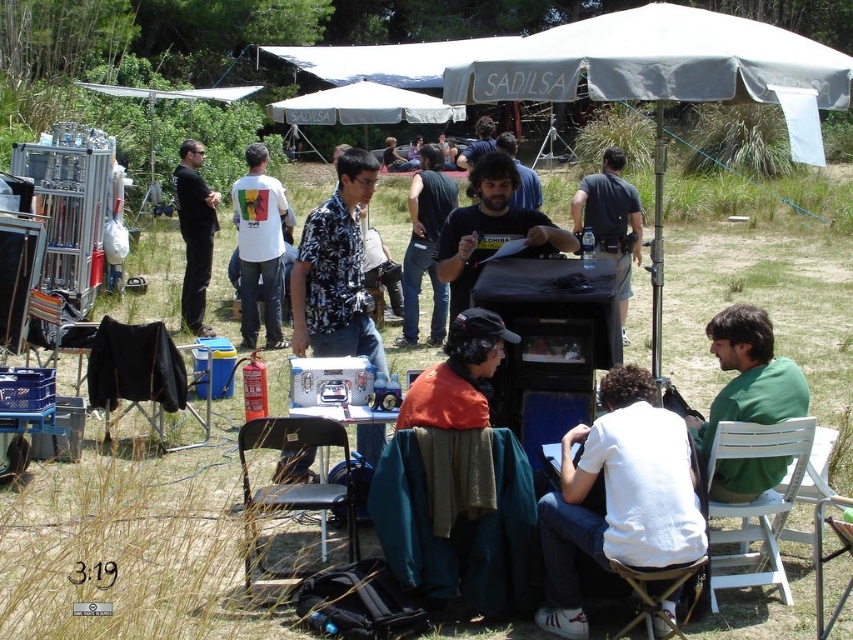
Is white cotton shirt at lower right wider than black fabric chair at lower left?

In fact, white cotton shirt at lower right might be narrower than black fabric chair at lower left.

Does point (650, 465) lie in front of point (96, 355)?

Yes, it is in front of point (96, 355).

The height and width of the screenshot is (640, 853). I want to click on white cotton shirt at lower right, so click(x=619, y=497).

The width and height of the screenshot is (853, 640). I want to click on white cotton shirt at lower right, so click(x=619, y=497).

Does black cotton shirt at center come behind white fabric canopy at upper center?

That is False.

Does point (403, 276) lie in front of point (410, 118)?

Yes, it is.

Image resolution: width=853 pixels, height=640 pixels. I want to click on black cotton shirt at center, so click(x=425, y=244).

Who is lower down, green fabric chair at lower center or white wood chair at lower right?

white wood chair at lower right is lower down.

Does green fabric chair at lower center come in front of white wood chair at lower right?

No, it is behind white wood chair at lower right.

The image size is (853, 640). What do you see at coordinates (460, 531) in the screenshot?
I see `green fabric chair at lower center` at bounding box center [460, 531].

This screenshot has height=640, width=853. I want to click on green fabric chair at lower center, so click(460, 531).